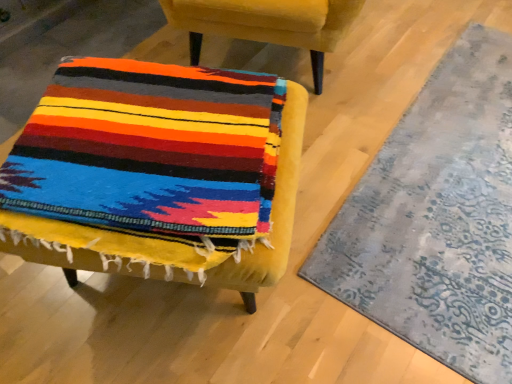
Locate an element on the screen. This screenshot has height=384, width=512. vacant space that is to the left of textured gray rug at lower right is located at coordinates (295, 207).